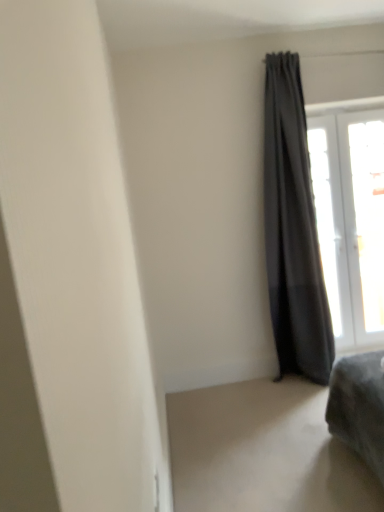
Find the location of a particular element. free point above transparent glass window at upper right, the first window when ordered from right to left (from a real-world perspective) is located at coordinates (361, 111).